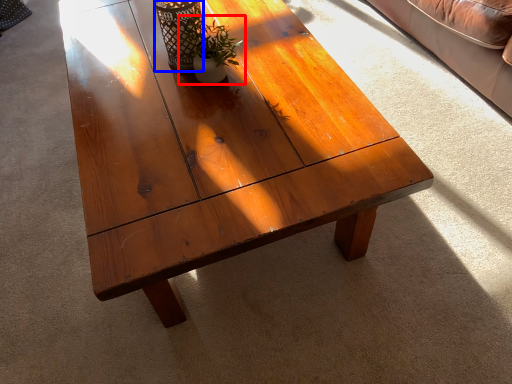
Question: Among these objects, which one is farthest to the camera, houseplant (highlighted by a red box) or glass vase (highlighted by a blue box)?

Choices:
 (A) houseplant
 (B) glass vase

Answer: (B)